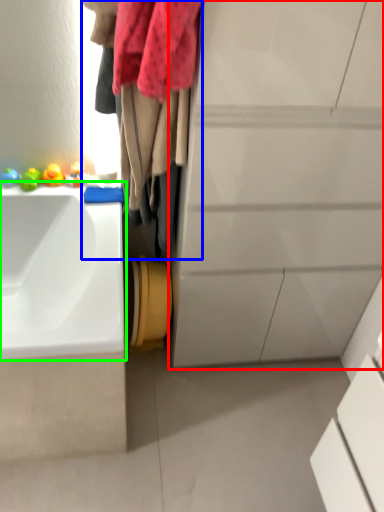
Question: Which is nearer to the bathroom cabinet (highlighted by a red box)? laundry (highlighted by a blue box) or sink (highlighted by a green box).

Choices:
 (A) laundry
 (B) sink

Answer: (A)